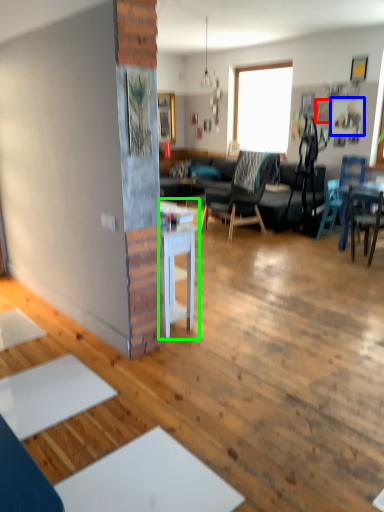
Question: Which is nearer to the picture frame (highlighted by a red box)? picture frame (highlighted by a blue box) or table (highlighted by a green box).

Choices:
 (A) picture frame
 (B) table

Answer: (A)